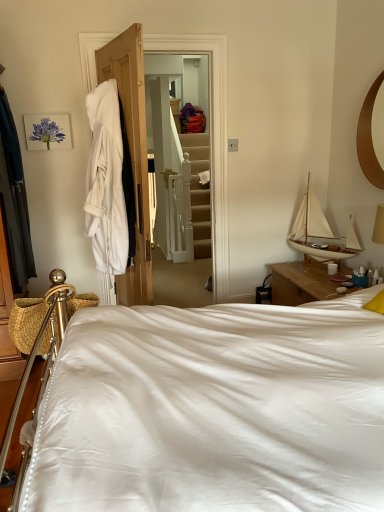
You are a GUI agent. You are given a task and a screenshot of the screen. Output one action in this format:
    pyautogui.click(x=<x>, y=<y>)
    Task: Click on the vacant region below white wood sailboat at upper right (from a real-world perspective)
    
    Given the screenshot: What is the action you would take?
    pyautogui.click(x=320, y=269)